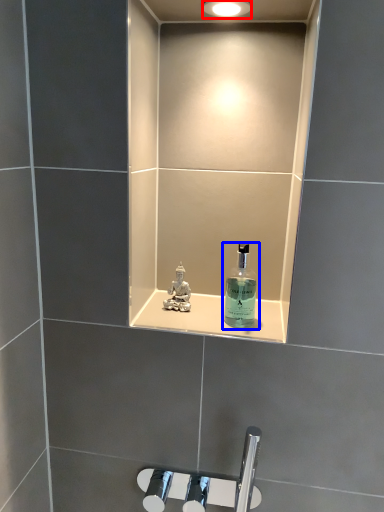
Question: Which point is further to the camera, light fixture (highlighted by a red box) or bottle (highlighted by a blue box)?

Choices:
 (A) light fixture
 (B) bottle

Answer: (B)